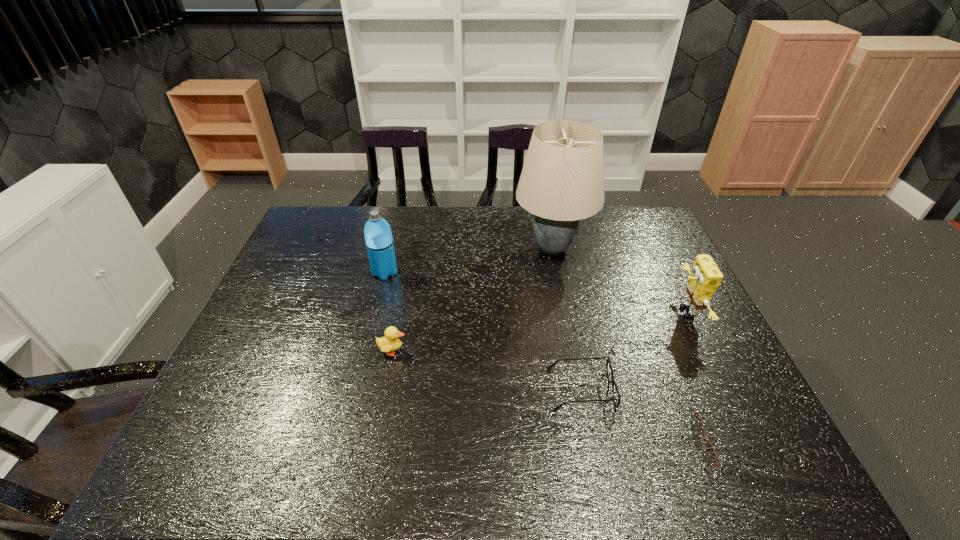
You are a GUI agent. You are given a task and a screenshot of the screen. Output one action in this format:
    pyautogui.click(x=<x>, y=<y>)
    Task: Click on the vacant area that lies between the sunglasses and the lampshade
    The width and height of the screenshot is (960, 540).
    Given the screenshot: What is the action you would take?
    point(637,345)

Find the location of a particular element. Image resolution: width=960 pixels, height=540 pixels. unoccupied position between the second tallest object and the spectacles is located at coordinates (483, 331).

You are a GUI agent. You are given a task and a screenshot of the screen. Output one action in this format:
    pyautogui.click(x=<x>, y=<y>)
    Task: Click on the object that ranks as the closest to the lampshade
    The width and height of the screenshot is (960, 540).
    Given the screenshot: What is the action you would take?
    pyautogui.click(x=705, y=278)

This screenshot has height=540, width=960. Identify the location of the fifth closest object to the tallest object. (698, 422).